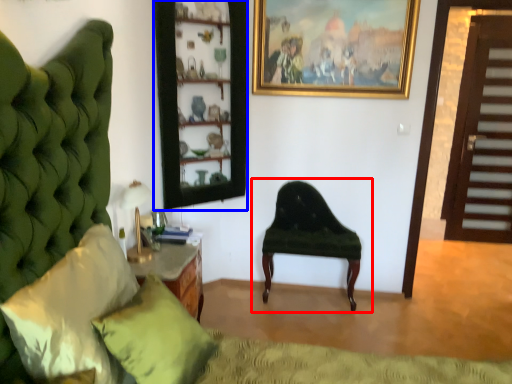
Question: Which object appears farthest to the camera in this image, chair (highlighted by a red box) or shelf (highlighted by a blue box)?

Choices:
 (A) chair
 (B) shelf

Answer: (A)